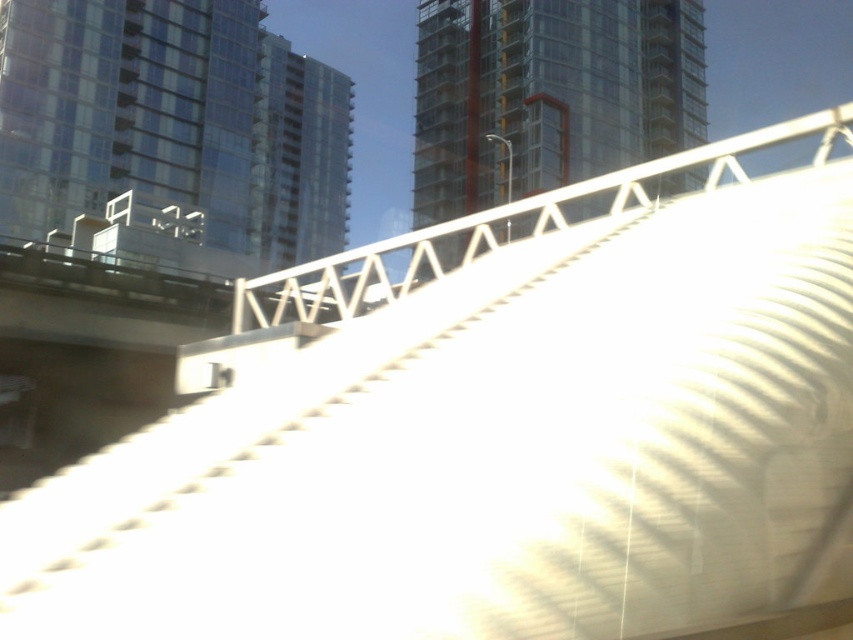
Question: Can you confirm if transparent glass tower at upper center is smaller than transparent glass building at center?

Choices:
 (A) yes
 (B) no

Answer: (B)

Question: Is transparent glass tower at upper center bigger than transparent glass building at center?

Choices:
 (A) yes
 (B) no

Answer: (A)

Question: Which of the following is the closest to the observer?

Choices:
 (A) transparent glass tower at upper center
 (B) transparent glass building at center

Answer: (A)

Question: Which object appears closest to the camera in this image?

Choices:
 (A) transparent glass building at center
 (B) transparent glass tower at upper center

Answer: (B)

Question: Does transparent glass tower at upper center appear over transparent glass building at center?

Choices:
 (A) no
 (B) yes

Answer: (A)